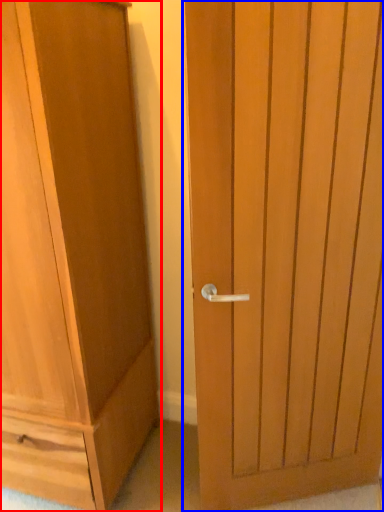
Question: Which of the following is the farthest to the observer, cupboard (highlighted by a red box) or door (highlighted by a blue box)?

Choices:
 (A) cupboard
 (B) door

Answer: (B)